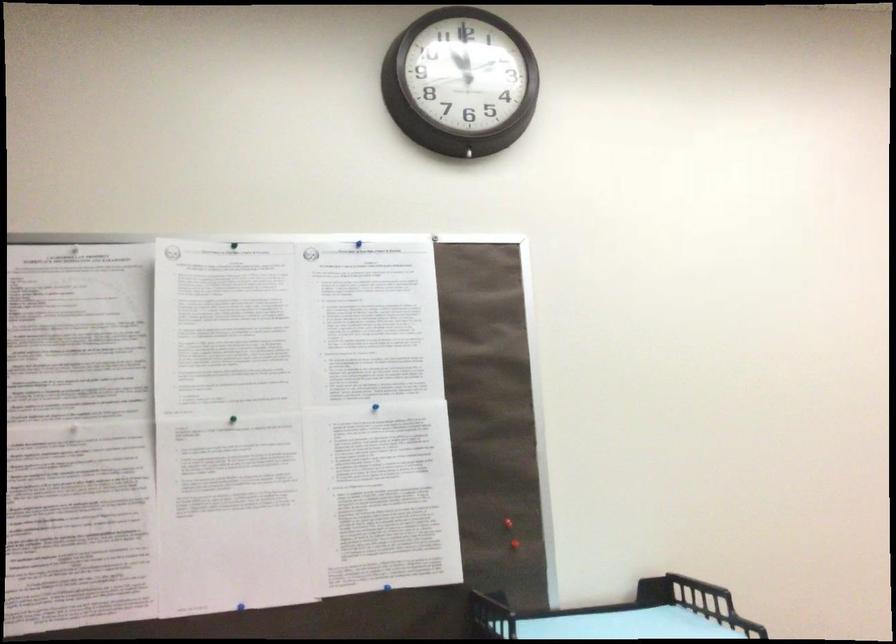
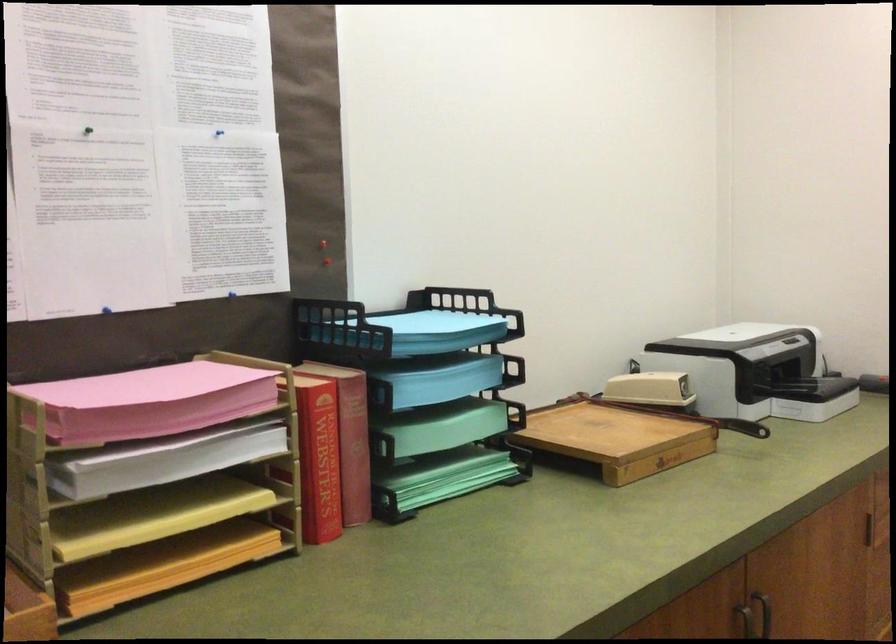
Locate, in the second image, the point that corresponds to point (375, 410) in the first image.

(218, 136)